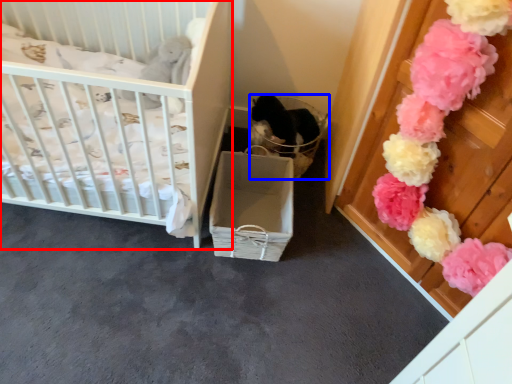
Question: Among these objects, which one is nearest to the camera, infant bed (highlighted by a red box) or basket (highlighted by a blue box)?

Choices:
 (A) infant bed
 (B) basket

Answer: (A)